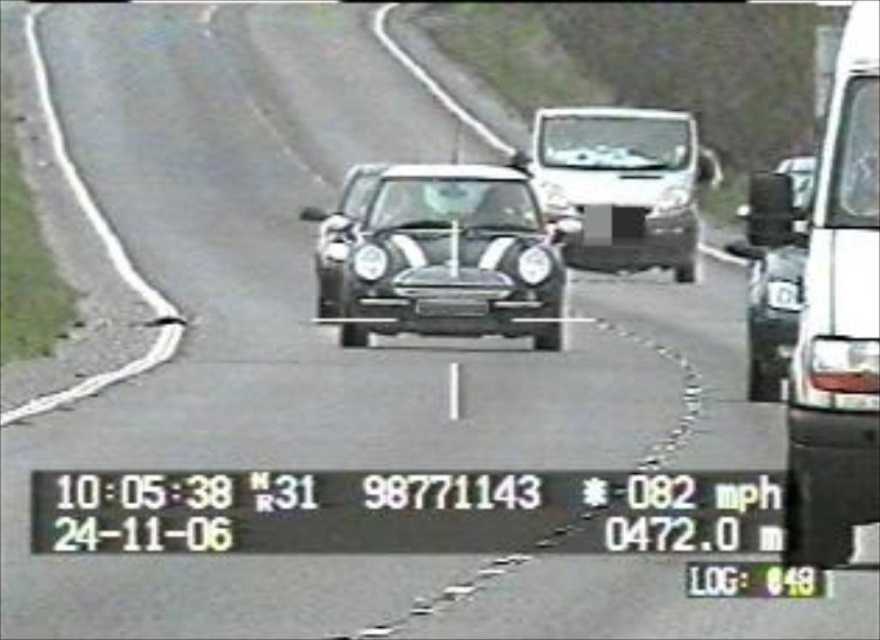
Describe the element at coordinates (622, 186) in the screenshot. This screenshot has height=640, width=880. I see `white glossy van at center` at that location.

Is point (543, 141) in front of point (798, 244)?

No, it is not.

Between point (584, 208) and point (794, 323), which one is positioned behind?

The point (584, 208) is behind.

The image size is (880, 640). Identify the location of white glossy van at center. (622, 186).

Does white matte van at right have a larger size compared to white glossy van at center?

Actually, white matte van at right might be smaller than white glossy van at center.

Does point (864, 74) lie in front of point (544, 131)?

Yes, it is in front of point (544, 131).

Find the location of a particular element. The image size is (880, 640). white matte van at right is located at coordinates (840, 320).

Can you confirm if white matte van at right is positioned to the left of glossy black car at center?

No, white matte van at right is not to the left of glossy black car at center.

Is white matte van at right positioned at the back of glossy black car at center?

No.

Which is behind, point (825, 122) or point (475, 316)?

The point (475, 316) is behind.

Locate an element on the screen. white matte van at right is located at coordinates (840, 320).